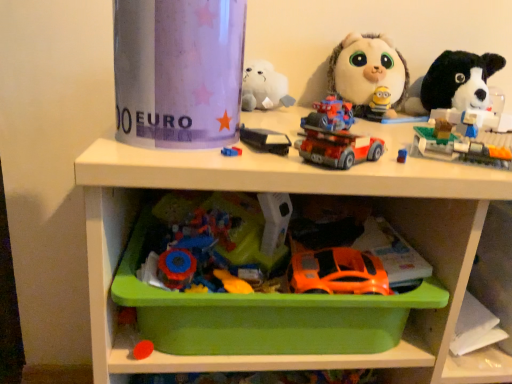
Question: Considering the positions of translucent plastic building blocks at upper right, the third toy when ordered from bottom to top, and fluffy white plush toy at upper right, positioned as the 1th toy in top-to-bottom order, in the image, is translucent plastic building blocks at upper right, the third toy when ordered from bottom to top, taller or shorter than fluffy white plush toy at upper right, positioned as the 1th toy in top-to-bottom order,?

Choices:
 (A) tall
 (B) short

Answer: (B)

Question: From the image's perspective, is translucent plastic building blocks at upper right, which is the third toy from top to bottom, positioned above or below fluffy white plush toy at upper right, positioned as the 1th toy in top-to-bottom order?

Choices:
 (A) above
 (B) below

Answer: (B)

Question: Based on their relative distances, which object is nearer to the fluffy white plush toy at upper right, the 5th toy positioned from the bottom?

Choices:
 (A) translucent plastic building blocks at upper right, which is the third toy from top to bottom
 (B) black plush dog at upper right, the 2th toy from the top
 (C) orange matte car at lower center, the 5th toy positioned from the top
 (D) green plastic tray at lower center
 (E) red plastic car at center, which is the 4th toy from top to bottom

Answer: (B)

Question: Which object is positioned farthest from the green plastic tray at lower center?

Choices:
 (A) orange matte car at lower center, the 5th toy positioned from the top
 (B) translucent plastic building blocks at upper right, the third toy when ordered from bottom to top
 (C) red plastic car at center, which is the 4th toy from top to bottom
 (D) fluffy white plush toy at upper right, the 5th toy positioned from the bottom
 (E) black plush dog at upper right, the 2th toy from the top

Answer: (E)